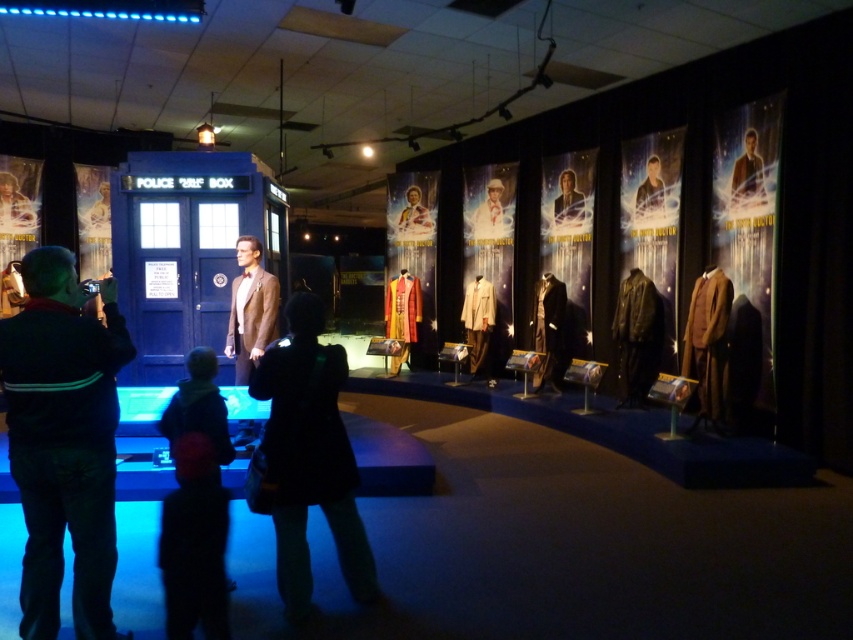
Which of these two, brown wool suit at center or brown leather jacket at upper center, stands shorter?

With less height is brown leather jacket at upper center.

Is point (273, 307) closer to camera compared to point (757, 186)?

Yes.

Find the location of `brown wool suit at center`. brown wool suit at center is located at coordinates (250, 308).

Does white cotton shirt at center lie in front of shiny silver suit at center?

No, it is not.

Can you confirm if white cotton shirt at center is smaller than shiny silver suit at center?

Actually, white cotton shirt at center might be larger than shiny silver suit at center.

Identify the location of white cotton shirt at center. This screenshot has width=853, height=640. (492, 212).

Can you confirm if brown wool suit at right is wider than white cotton shirt at center?

In fact, brown wool suit at right might be narrower than white cotton shirt at center.

Based on the photo, which of these two, brown wool suit at right or white cotton shirt at center, stands taller?

brown wool suit at right is taller.

Describe the element at coordinates (708, 340) in the screenshot. I see `brown wool suit at right` at that location.

Identify the location of brown wool suit at right. The image size is (853, 640). (708, 340).